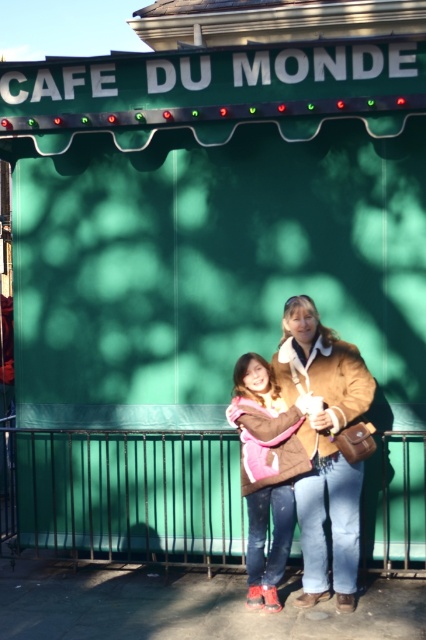
Between brown suede jacket at center and brown fuzzy jacket at center, which one appears on the right side from the viewer's perspective?

Positioned to the right is brown suede jacket at center.

Between point (324, 452) and point (293, 529), which one is positioned in front?

Positioned in front is point (324, 452).

At what (x,y) coordinates should I click in order to perform the action: click on brown suede jacket at center. Please return your answer as a coordinate pair (x, y). The height and width of the screenshot is (640, 426). Looking at the image, I should click on (325, 448).